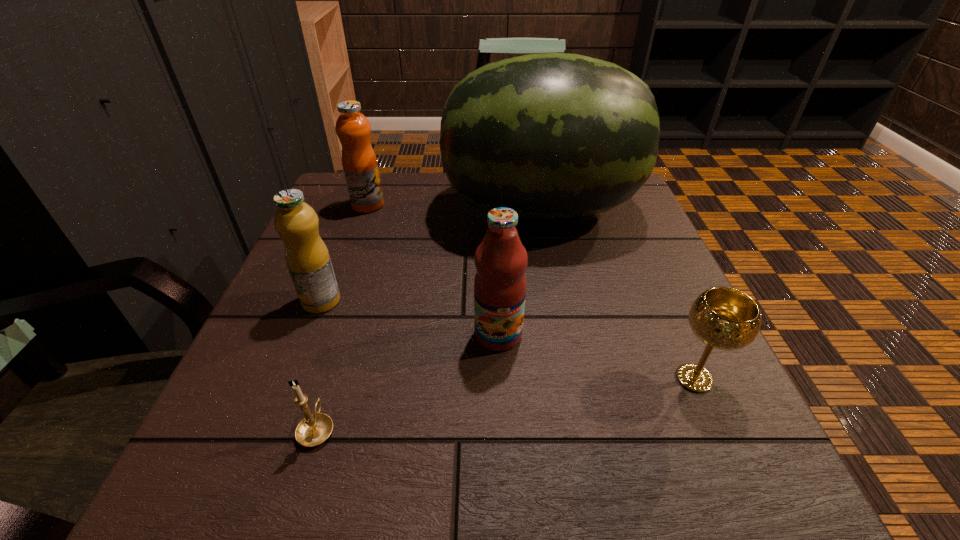
Where is `vacant space at the far left corner`? vacant space at the far left corner is located at coordinates (334, 201).

You are a GUI agent. You are given a task and a screenshot of the screen. Output one action in this format:
    pyautogui.click(x=<x>, y=<y>)
    Task: Click on the vacant space at the near right corner of the desktop
    This screenshot has height=540, width=960.
    Given the screenshot: What is the action you would take?
    pyautogui.click(x=747, y=458)

Where is `vacant space that's between the chalice and the rightmost fruit juice`? The image size is (960, 540). vacant space that's between the chalice and the rightmost fruit juice is located at coordinates (596, 356).

Locate an element on the screen. The height and width of the screenshot is (540, 960). vacant region between the farthest fruit juice and the tallest object is located at coordinates (454, 207).

Find the location of a particular element. empty space that is in between the rightmost fruit juice and the second nearest object is located at coordinates (596, 356).

This screenshot has width=960, height=540. What are the coordinates of `vacant area that lies between the fourth farthest object and the farthest fruit juice` in the screenshot? It's located at (433, 270).

At what (x,y) coordinates should I click in order to perform the action: click on free space between the watermelon and the farthest fruit juice. Please return your answer as a coordinate pair (x, y). The height and width of the screenshot is (540, 960). Looking at the image, I should click on (454, 207).

Where is `vacant region between the tallest object and the farthest fruit juice`? This screenshot has height=540, width=960. vacant region between the tallest object and the farthest fruit juice is located at coordinates (454, 207).

You are a GUI agent. You are given a task and a screenshot of the screen. Output one action in this format:
    pyautogui.click(x=<x>, y=<y>)
    Task: Click on the vacant point located between the farthest fruit juice and the nearest object
    Image resolution: width=960 pixels, height=540 pixels.
    Given the screenshot: What is the action you would take?
    pyautogui.click(x=343, y=317)

This screenshot has width=960, height=540. Find the location of `free space between the second nearest object and the shortest object`. free space between the second nearest object and the shortest object is located at coordinates (506, 403).